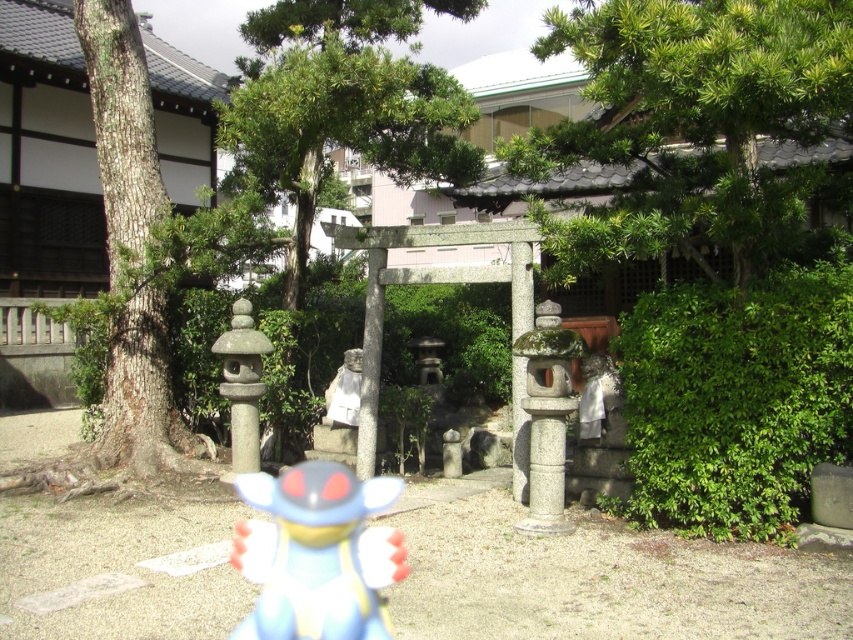
You are a visitor at the Japanese garden and want to place a new decorative item between the shiny plastic toy at center and the matte stone statue at center. Which object should you place it closer to if you want the new item to be aligned with the wider object?

You should place the new decorative item closer to the shiny plastic toy at center because its width surpasses that of the matte stone statue at center.

You are a visitor standing at the entrance of the Japanese garden. You notice a brown rough bark tree at left and a matte stone statue at center. Which object is positioned higher in the scene?

The brown rough bark tree at left is positioned higher than the matte stone statue at center.